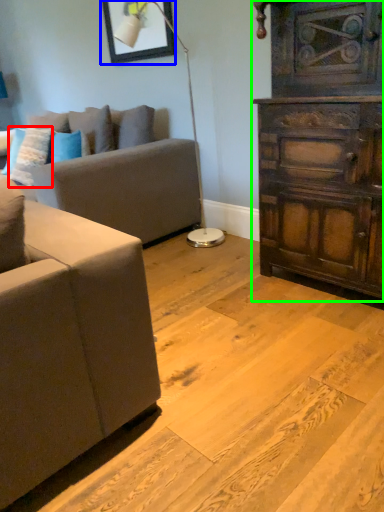
Question: Which object is the farthest from pillow (highlighted by a red box)? Choose among these: picture frame (highlighted by a blue box) or chest of drawers (highlighted by a green box).

Choices:
 (A) picture frame
 (B) chest of drawers

Answer: (B)